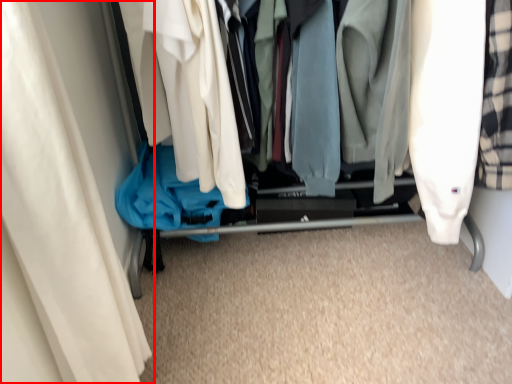
Question: Observing the image, what is the correct spatial positioning of curtain (annotated by the red box) in reference to closet?

Choices:
 (A) right
 (B) left

Answer: (B)